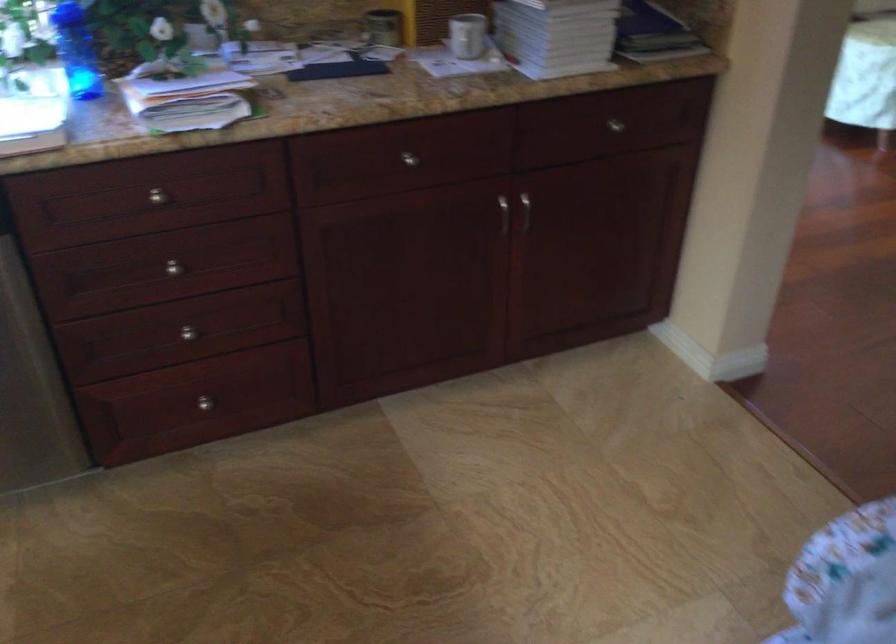
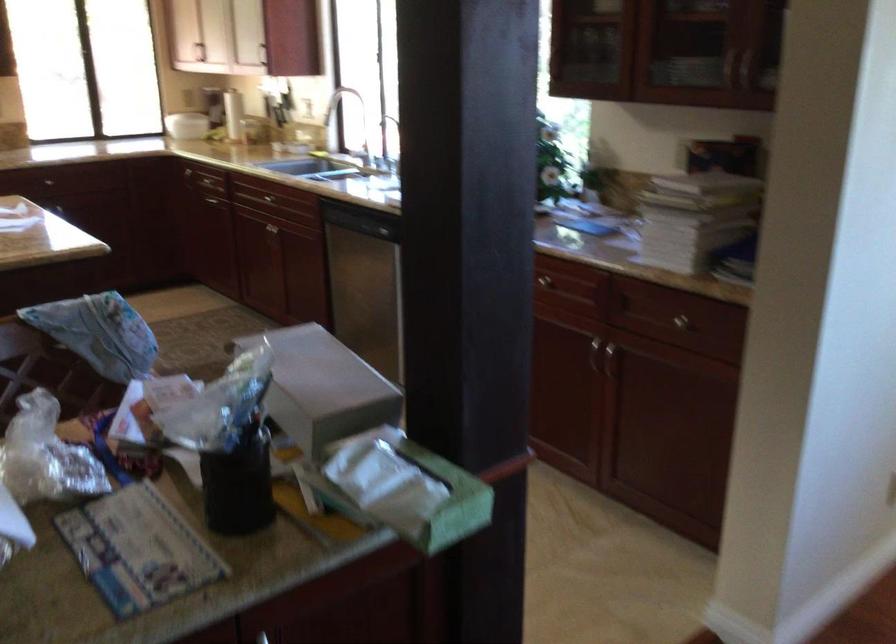
Question: I am providing you with two images of the same scene from different viewpoints. Which of the following objects are not visible in image2?

Choices:
 (A) grey cardboard box
 (B) blue water bottle
 (C) faucet handle
 (D) fire extinguisher pin

Answer: (B)